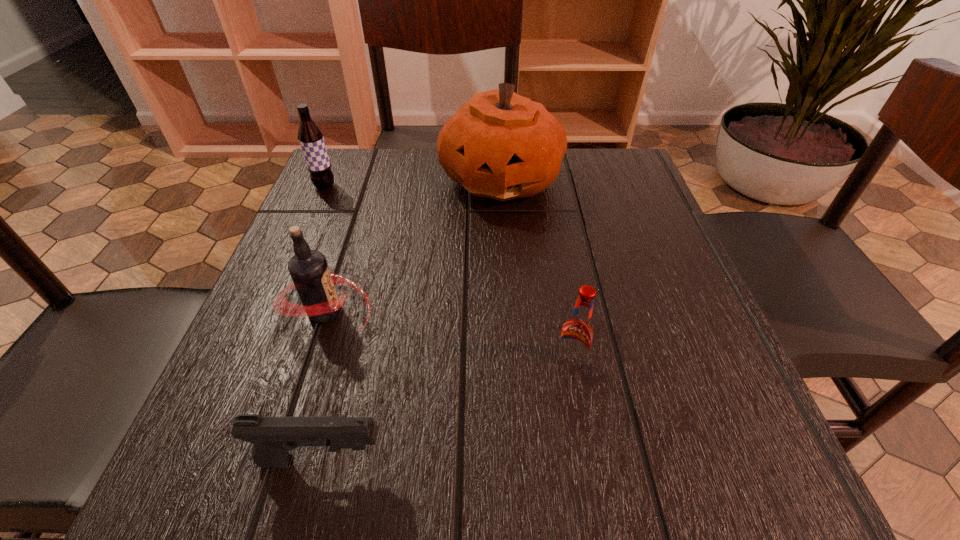
At what (x,y) coordinates should I click in order to perform the action: click on the tallest object. Please return your answer as a coordinate pair (x, y). The width and height of the screenshot is (960, 540). Looking at the image, I should click on (500, 145).

The height and width of the screenshot is (540, 960). Find the location of `the farthest root beer`. the farthest root beer is located at coordinates (310, 137).

The width and height of the screenshot is (960, 540). What are the coordinates of `the third farthest object` in the screenshot? It's located at click(x=309, y=270).

Find the location of `the second nearest object`. the second nearest object is located at coordinates (577, 333).

This screenshot has height=540, width=960. What are the coordinates of `the nearest root beer` in the screenshot? It's located at (577, 333).

What are the coordinates of `the shortest object` in the screenshot? It's located at (273, 437).

Identify the location of pistol. (273, 437).

Where is `free space located 0.350m on the front-facing side of the pumpkin`? Image resolution: width=960 pixels, height=540 pixels. free space located 0.350m on the front-facing side of the pumpkin is located at coordinates (511, 355).

Where is `free region located 0.110m on the front of the farthest root beer`? Image resolution: width=960 pixels, height=540 pixels. free region located 0.110m on the front of the farthest root beer is located at coordinates (308, 223).

I want to click on vacant space located on the label of the third farthest object, so 468,311.